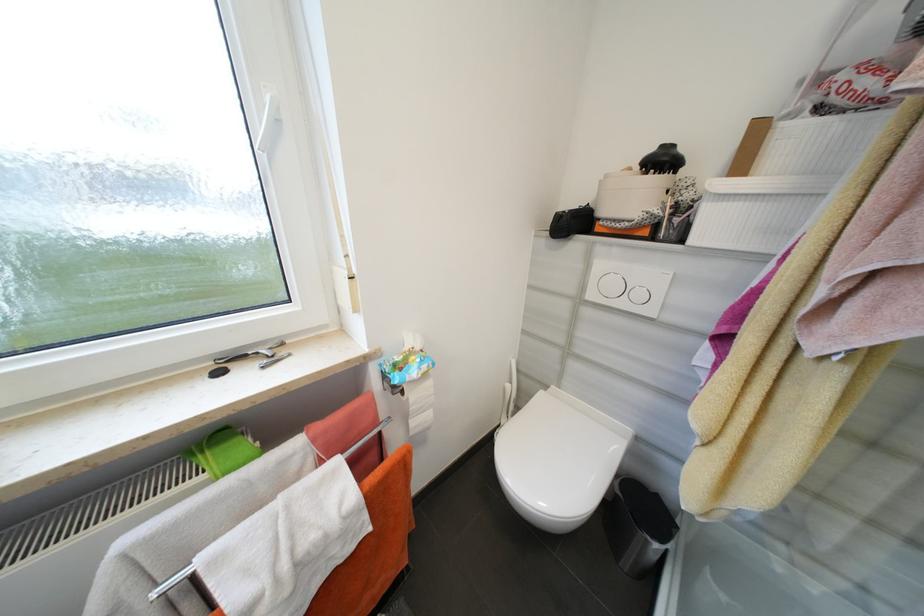
Locate an element on the screen. The height and width of the screenshot is (616, 924). small flush button is located at coordinates (638, 294).